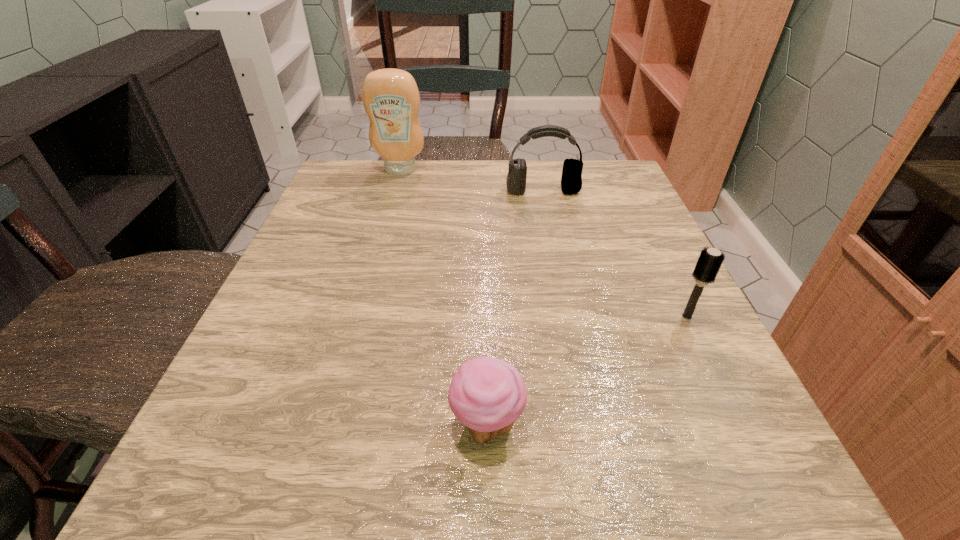
The image size is (960, 540). I want to click on free region at the far edge of the desktop, so click(484, 205).

In the image, there is a desktop. Where is `vacant space at the near edge`? This screenshot has width=960, height=540. vacant space at the near edge is located at coordinates click(468, 461).

Image resolution: width=960 pixels, height=540 pixels. I want to click on free space at the left edge of the desktop, so click(271, 413).

Locate an element on the screen. blank space at the right edge of the desktop is located at coordinates (647, 374).

In the image, there is a desktop. Where is `free space at the far left corner`? free space at the far left corner is located at coordinates (382, 161).

The height and width of the screenshot is (540, 960). Identify the location of vacant space at the far right corner of the desktop. (600, 182).

I want to click on empty location between the headset and the nearest object, so click(515, 308).

At what (x,y) coordinates should I click in order to perform the action: click on vacant space that's between the farthest object and the second farthest object. Please return your answer as a coordinate pair (x, y). The width and height of the screenshot is (960, 540). Looking at the image, I should click on (471, 180).

Where is `unoccupied area between the third nearest object and the second shortest object`? Image resolution: width=960 pixels, height=540 pixels. unoccupied area between the third nearest object and the second shortest object is located at coordinates coord(614,254).

Locate an element on the screen. Image resolution: width=960 pixels, height=540 pixels. free point between the condiment and the second farthest object is located at coordinates (471, 180).